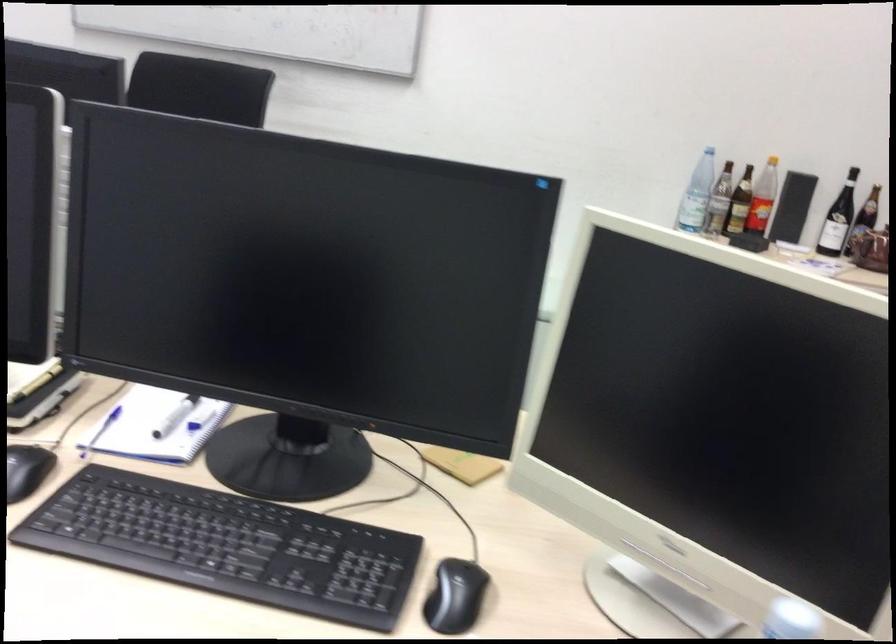
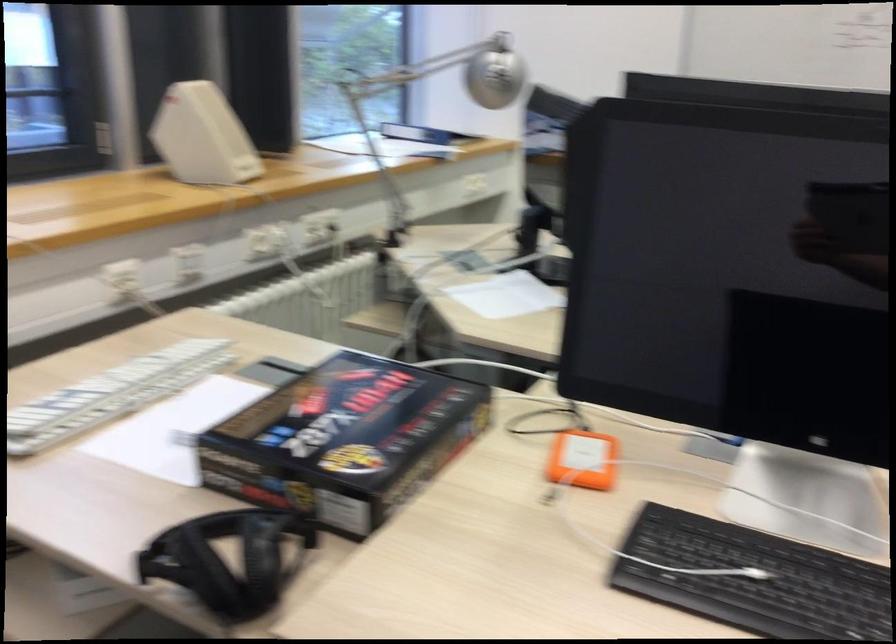
Question: The camera is either moving clockwise (left) or counter-clockwise (right) around the object. The first image is from the beginning of the video and the second image is from the end. Is the camera moving left or right when shooting the video?

Choices:
 (A) Left
 (B) Right

Answer: (B)